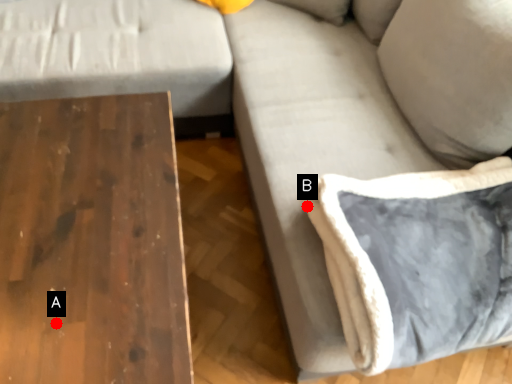
Question: Two points are circled on the image, labeled by A and B beside each circle. Which point is closer to the camera?

Choices:
 (A) A is closer
 (B) B is closer

Answer: (A)